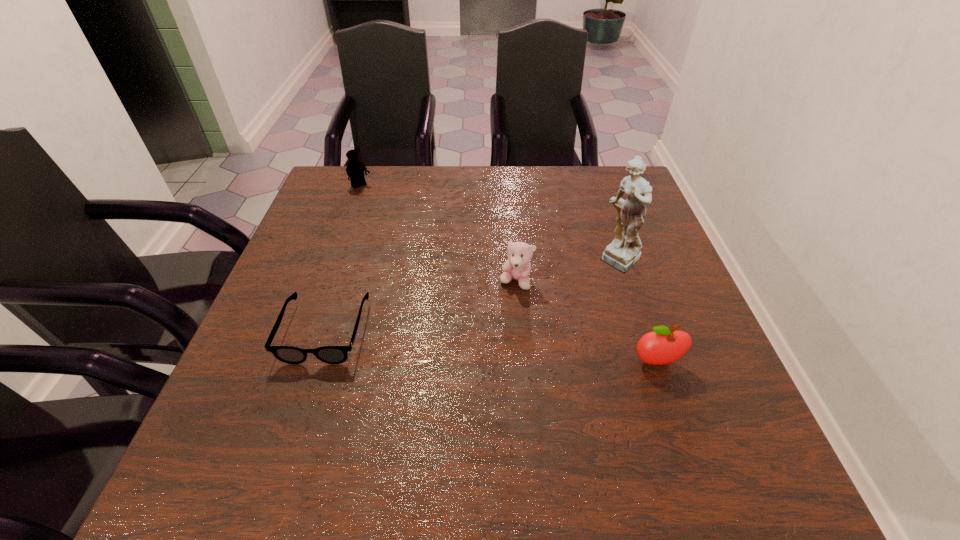
The image size is (960, 540). I want to click on free space between the teddy bear and the Lego, so click(439, 234).

Locate an element on the screen. The height and width of the screenshot is (540, 960). free point between the apple and the shortest object is located at coordinates (491, 346).

Identify the location of vacant space that is in between the Lego and the third object from left to right. This screenshot has height=540, width=960. (439, 234).

Locate an element on the screen. blank region between the apple and the figurine is located at coordinates (638, 312).

The image size is (960, 540). Identify the location of unoccupied position between the third object from left to right and the spectacles. (420, 306).

You are a GUI agent. You are given a task and a screenshot of the screen. Output one action in this format:
    pyautogui.click(x=<x>, y=<y>)
    Task: Click on the empty location between the Lego and the figurine
    This screenshot has width=960, height=540.
    Given the screenshot: What is the action you would take?
    pyautogui.click(x=491, y=224)

Where is `unoccupied position between the Lego and the third object from right to left`? unoccupied position between the Lego and the third object from right to left is located at coordinates (439, 234).

The width and height of the screenshot is (960, 540). I want to click on unoccupied area between the Lego and the tallest object, so click(x=491, y=224).

Where is `free space between the farthest object and the tallest object`? free space between the farthest object and the tallest object is located at coordinates (491, 224).

Choose which object is the third nearest neighbor to the tallest object. Please provide its 2D coordinates. Your answer should be formatted as a tuple, i.e. [(x, y)], where the tuple contains the x and y coordinates of a point satisfying the conditions above.

[(288, 354)]